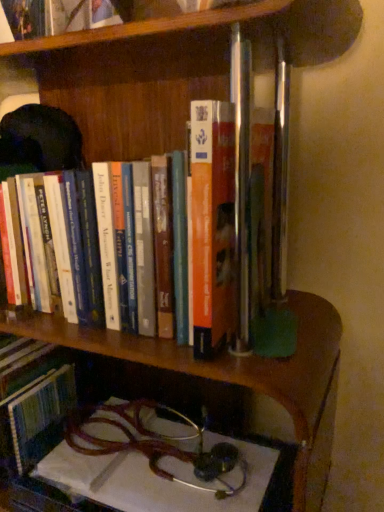
Question: Is point (57, 10) positioned closer to the camera than point (299, 354)?

Choices:
 (A) farther
 (B) closer

Answer: (A)

Question: Is hardcover book at upper center, which is the first book in top-to-bottom order, taller or shorter than metallic stethoscope at lower center?

Choices:
 (A) short
 (B) tall

Answer: (A)

Question: Which of these objects is positioned farthest from the hardcover book at center, which is counted as the second book, starting from the top?

Choices:
 (A) hardcover book at upper center, which is the first book in top-to-bottom order
 (B) metallic stethoscope at lower center

Answer: (A)

Question: Considering the real-world distances, which object is closest to the hardcover book at center, the first book when ordered from bottom to top?

Choices:
 (A) metallic stethoscope at lower center
 (B) hardcover book at upper center, which is the first book in top-to-bottom order

Answer: (A)